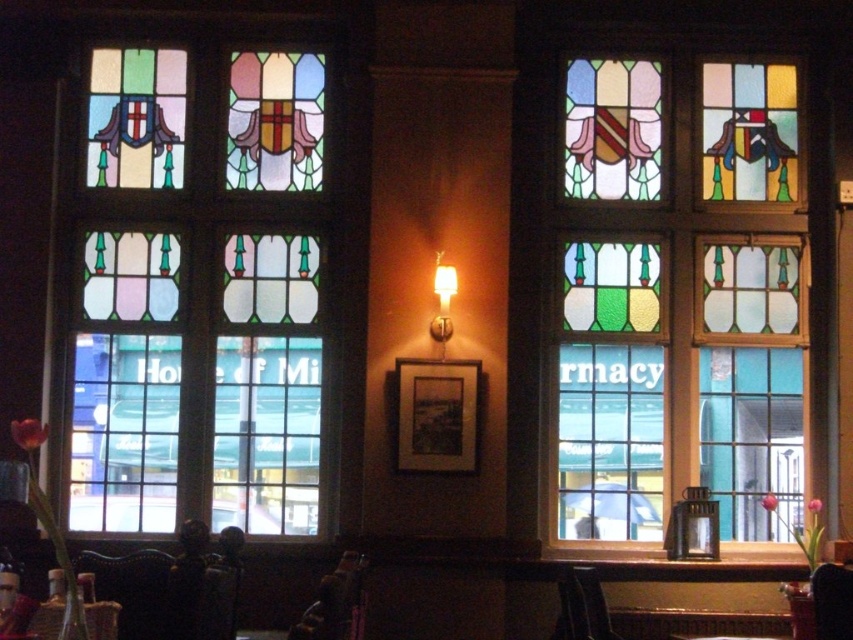
You are an interior designer planning to install a new wall fixture between the stained glass window at left and the stained glass window at center. The fixture requires a minimum of 1 meter of space between the windows to be centered properly. Given the widths of the windows, can the fixture be placed between them?

The stained glass window at left is wider than the stained glass window at center. Therefore, the space between them may not be sufficient for the fixture requiring 1 meter. To determine feasibility, the total distance between the edges of both windows must be calculated. However, since the left window is wider, it might encroach into the required space, making placement challenging without precise measurements.

You are standing at the camera position and want to take a photo of the stained glass window at center. Considering the distance between you and the window, will you need a zoom lens to capture the entire window in your shot?

The stained glass window at center and camera are 54.43 meters apart. To capture the entire window at this distance, you would likely need a zoom lens to ensure the window fits within the frame.